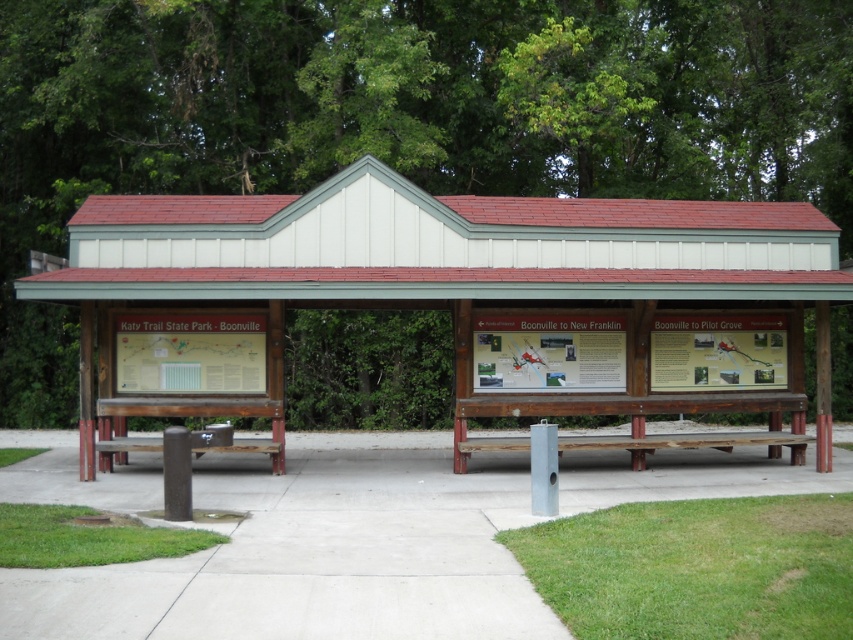
Question: Estimate the real-world distances between objects in this image. Which object is closer to the concrete at center?

Choices:
 (A) brown wooden bench at lower left
 (B) wooden bench at center
 (C) brown wooden bench at center

Answer: (B)

Question: Which point appears closest to the camera in this image?

Choices:
 (A) (425, 464)
 (B) (779, 449)
 (C) (258, 444)

Answer: (C)

Question: Does concrete at center appear on the left side of brown wooden bench at center?

Choices:
 (A) no
 (B) yes

Answer: (B)

Question: Is concrete at center further to the viewer compared to brown wooden bench at center?

Choices:
 (A) no
 (B) yes

Answer: (A)

Question: Estimate the real-world distances between objects in this image. Which object is farther from the brown wooden bench at lower left?

Choices:
 (A) concrete at center
 (B) wooden bench at center

Answer: (B)

Question: Does wooden bench at center appear on the left side of concrete at center?

Choices:
 (A) no
 (B) yes

Answer: (A)